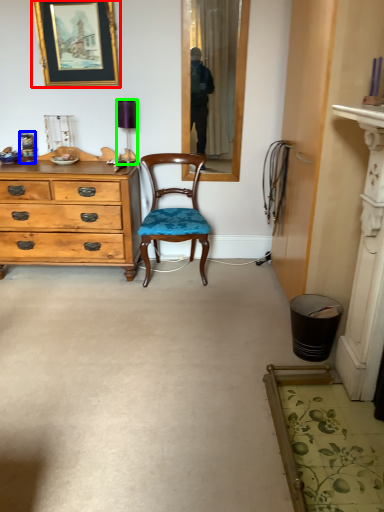
Question: Estimate the real-world distances between objects in this image. Which object is closer to picture frame (highlighted by a red box), bottle (highlighted by a blue box) or lamp (highlighted by a green box)?

Choices:
 (A) bottle
 (B) lamp

Answer: (B)